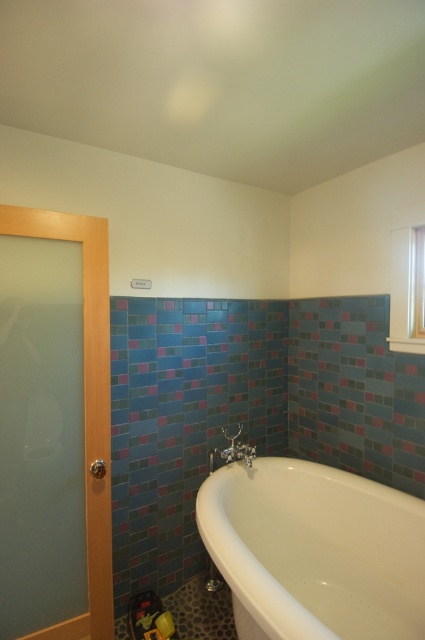
Is frosted glass screen door at left positioned at the back of chrome metallic faucet at lower center?

No, frosted glass screen door at left is closer to the viewer.

Who is lower down, frosted glass screen door at left or chrome metallic faucet at lower center?

chrome metallic faucet at lower center

Measure the distance between point [108,564] and camera.

Point [108,564] and camera are 6.44 feet apart.

Identify the location of frosted glass screen door at left. (87, 387).

Is white glossy bathtub at lower right smaller than chrome metallic faucet at lower center?

No.

Does white glossy bathtub at lower right appear on the left side of chrome metallic faucet at lower center?

No, white glossy bathtub at lower right is not to the left of chrome metallic faucet at lower center.

The image size is (425, 640). Describe the element at coordinates (314, 552) in the screenshot. I see `white glossy bathtub at lower right` at that location.

This screenshot has width=425, height=640. I want to click on white glossy bathtub at lower right, so click(314, 552).

Which is more to the left, white glossy bathtub at lower right or frosted glass screen door at left?

frosted glass screen door at left

Is point (408, 513) positioned in front of point (88, 484)?

No, it is behind (88, 484).

Locate an element on the screen. white glossy bathtub at lower right is located at coordinates (314, 552).